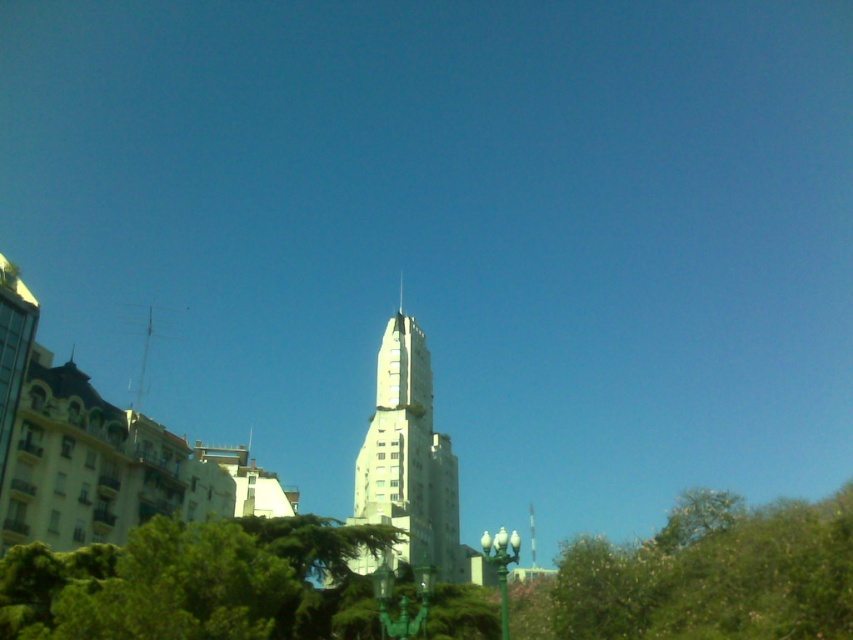
Can you confirm if green leafy tree at lower right is positioned below white smooth tower at center?

Actually, green leafy tree at lower right is above white smooth tower at center.

Identify the location of green leafy tree at lower right. (714, 573).

Can you confirm if green leafy tree at lower center is positioned to the left of green leafy tree at lower right?

Yes, green leafy tree at lower center is to the left of green leafy tree at lower right.

Is green leafy tree at lower center taller than green leafy tree at lower right?

Yes.

Does point (677, 582) come closer to viewer compared to point (685, 563)?

Yes, point (677, 582) is in front of point (685, 563).

Where is `green leafy tree at lower center`? This screenshot has height=640, width=853. green leafy tree at lower center is located at coordinates (187, 586).

Between green leafy tree at lower left and white stone spire at center, which one has more height?

With more height is green leafy tree at lower left.

Does point (161, 586) come farther from viewer compared to point (402, 276)?

No, it is not.

The image size is (853, 640). What do you see at coordinates (194, 582) in the screenshot?
I see `green leafy tree at lower left` at bounding box center [194, 582].

Locate an element on the screen. The image size is (853, 640). green leafy tree at lower left is located at coordinates (194, 582).